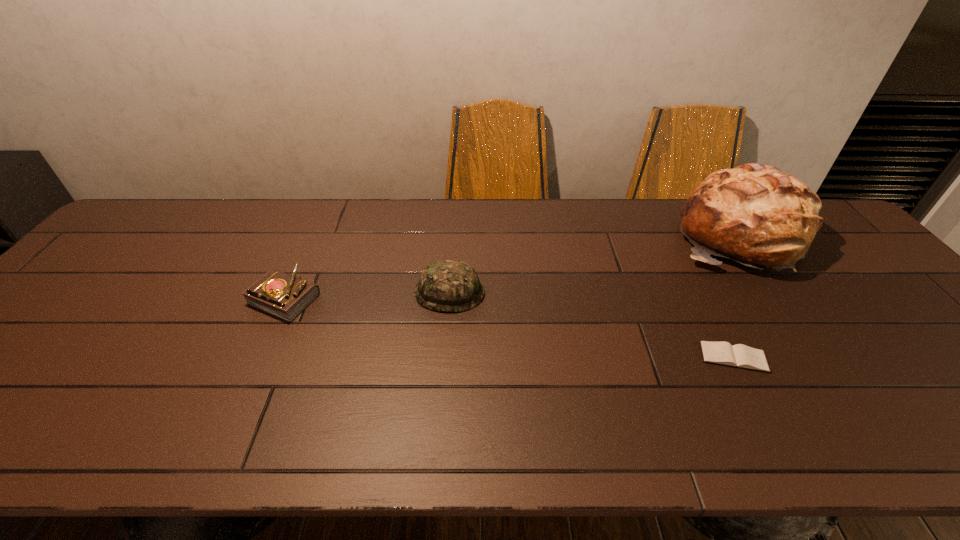
Locate an element on the screen. vacant space that's between the nearer diary and the taller diary is located at coordinates (510, 327).

Where is `unoccupied position between the bread and the shorter diary`? This screenshot has width=960, height=540. unoccupied position between the bread and the shorter diary is located at coordinates (735, 297).

Find the location of a particular element. Image resolution: width=960 pixels, height=540 pixels. free space between the second shortest object and the second object from left to right is located at coordinates tap(368, 295).

Where is `free point between the third tallest object and the shorter diary`? Image resolution: width=960 pixels, height=540 pixels. free point between the third tallest object and the shorter diary is located at coordinates (510, 327).

At what (x,y) coordinates should I click in order to perform the action: click on free space between the second object from left to right and the shortest object. Please return your answer as a coordinate pair (x, y). Looking at the image, I should click on (591, 325).

In order to click on vacant area between the headwear and the bread in this screenshot , I will do `click(594, 265)`.

Identify the location of vacant area between the nearest object and the second tallest object. The image size is (960, 540). (591, 325).

Identify the location of free space between the tallest object and the nearer diary. The height and width of the screenshot is (540, 960). (735, 297).

I want to click on object that stands as the closest to the headwear, so click(285, 296).

Find the location of a particular element. object that is the third closest to the taller diary is located at coordinates (755, 214).